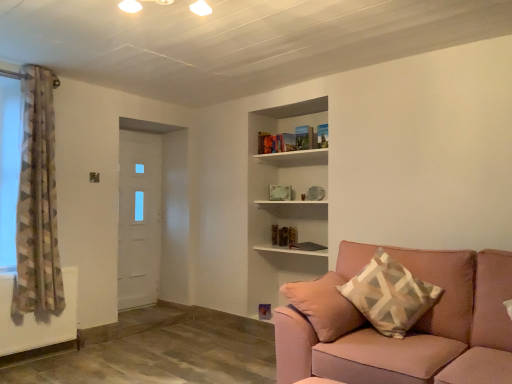
Question: Based on their sizes in the image, would you say pink fabric couch at lower right is bigger or smaller than white matte door at left?

Choices:
 (A) small
 (B) big

Answer: (B)

Question: Is pink fabric couch at lower right in front of or behind white matte door at left in the image?

Choices:
 (A) front
 (B) behind

Answer: (A)

Question: Which object is the farthest from the pink fabric couch at lower right?

Choices:
 (A) beige geometric-patterned pillow at right
 (B) white matte door at left
 (C) geometric-patterned fabric curtain at left
 (D) white wooden shelf at upper center

Answer: (B)

Question: Based on their relative distances, which object is nearer to the beige geometric-patterned pillow at right?

Choices:
 (A) white matte door at left
 (B) white wooden shelf at upper center
 (C) pink fabric couch at lower right
 (D) geometric-patterned fabric curtain at left

Answer: (C)